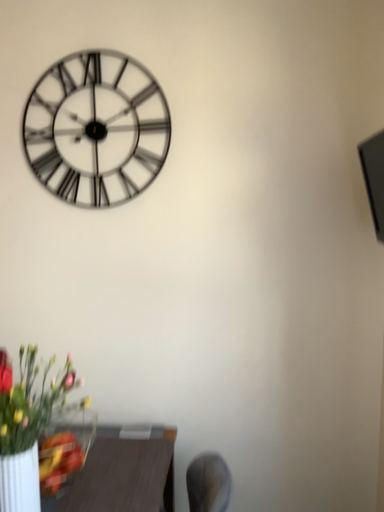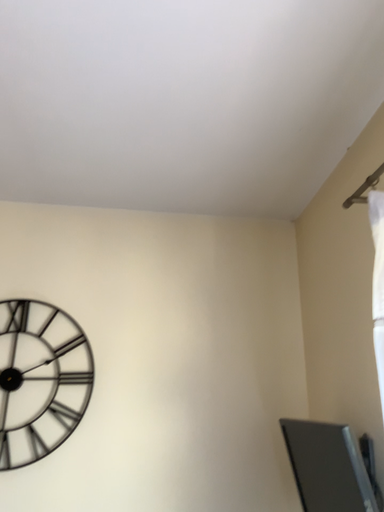
Question: Which way did the camera rotate in the video?

Choices:
 (A) rotated right
 (B) rotated left

Answer: (A)